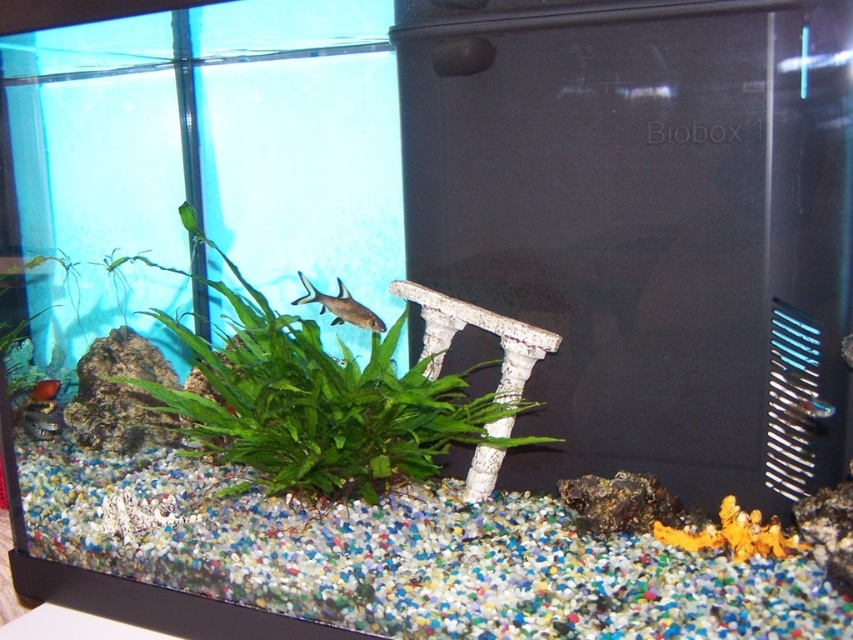
Consider the image. You are an aquatic biologist observing the aquarium. You notice two fish, the shiny silver fish at center and the matte black fish at lower left. Which fish has a larger height?

The shiny silver fish at center has a greater height compared to the matte black fish at lower left.

You are an aquatic creature swimming in the aquarium. You see the green leafy plant at center and the matte black fish at lower left. Which object is positioned to the right of the other?

The green leafy plant at center is to the right of the matte black fish at lower left.